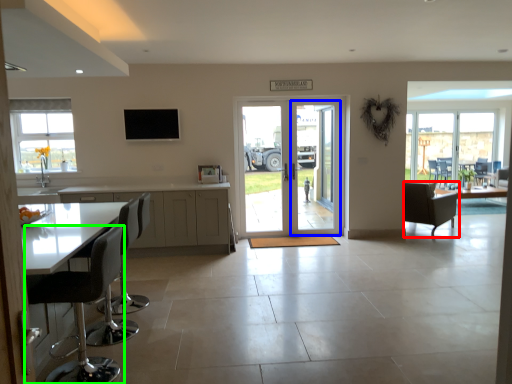
Question: Which object is positioned closest to chair (highlighted by a red box)? Select from screen door (highlighted by a blue box) and chair (highlighted by a green box).

Choices:
 (A) screen door
 (B) chair

Answer: (A)